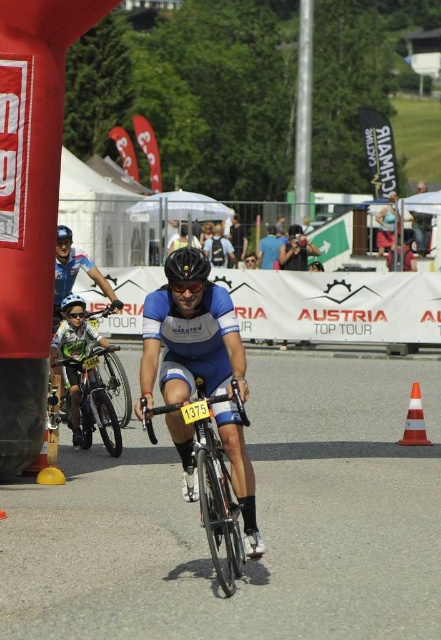
Looking at this image, you are a photographer positioned at the starting line of the cycling event. You want to capture a clear photo of both the black matte bicycle helmet at center and the matte black helmet at center. Which helmet will appear larger in your photo?

The black matte bicycle helmet at center will appear larger in the photo because it is closer to the viewer than the matte black helmet at center.

You are a photographer at the Austria Top Tour event. You need to capture a photo that includes both the green matte bicycle at left and the orange reflective cone at lower right. Considering their sizes, which object will appear larger in the photo?

The green matte bicycle at left will appear larger in the photo because it is bigger than the orange reflective cone at lower right.

You are a photographer positioned at the starting line of the cycling event. You want to capture a photo of the cyclist wearing the blue and white racing outfit with the number 1375. In your viewfinder, you notice the black matte bicycle helmet at center and the orange reflective cone at lower right. Which object should you focus on first to ensure the cyclist is clearly visible in your shot?

The black matte bicycle helmet at center is in front of the orange reflective cone at lower right, so focusing on the black matte bicycle helmet at center first will ensure the cyclist is clearly visible in your shot.